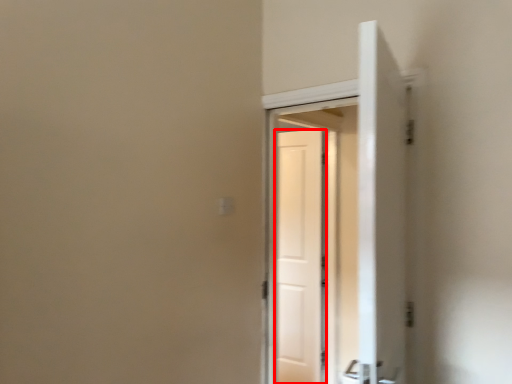
Question: From the image's perspective, considering the relative positions of door (annotated by the red box) and screen door in the image provided, where is door (annotated by the red box) located with respect to the staircase?

Choices:
 (A) below
 (B) above

Answer: (A)